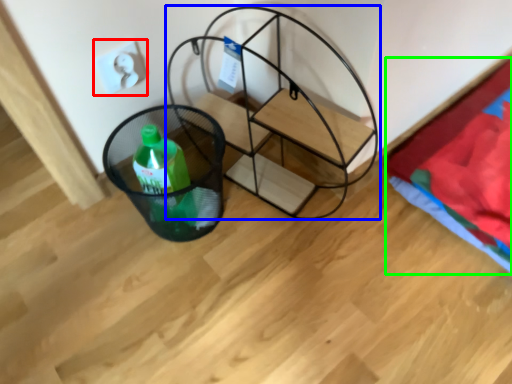
Question: Estimate the real-world distances between objects in this image. Which object is farther from electric outlet (highlighted by a red box), furniture (highlighted by a blue box) or blanket (highlighted by a green box)?

Choices:
 (A) furniture
 (B) blanket

Answer: (B)